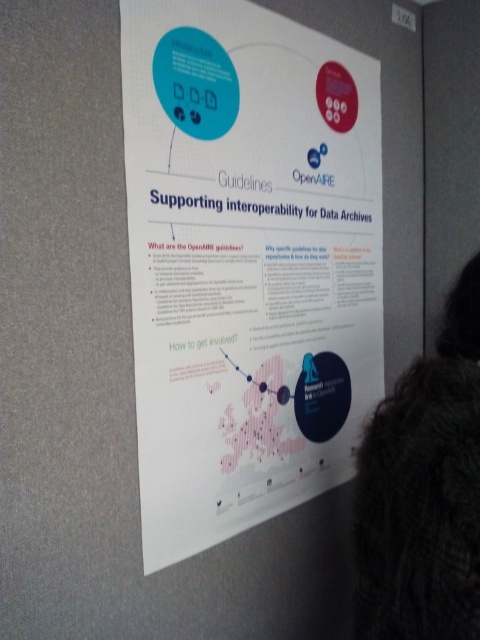
You are standing in front of an informational display at a conference. You see a white paper poster at center and a fuzzy brown fur at lower right. Which object is closer to you?

The white paper poster at center is closer to you because it is further to the viewer than the fuzzy brown fur at lower right.